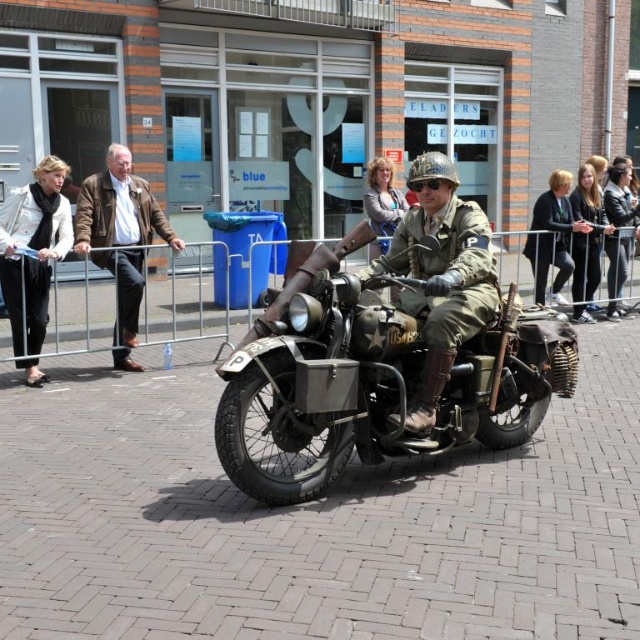
You are a photographer at the event and want to capture both the camouflage fabric jacket at center and the white leather jacket at left in a single shot. Which jacket should you focus on first to ensure both are in frame?

The camouflage fabric jacket at center is positioned under the white leather jacket at left, so focusing on the white leather jacket at left first will ensure both are in frame as the camouflage jacket is below it.

You are a photographer positioned at the center of the image. You want to capture a photo of the matte olive green motorcycle at center. Where should you point your camera to ensure the motorcycle is centered in your shot?

The matte olive green motorcycle at center is already positioned at the center of the image at coordinates point (376, 378), so pointing the camera towards the center will capture it perfectly.

Based on the photo, you are a photographer standing behind the metal barricade. You want to take a photo of both the camouflage fabric jacket at center and the white leather jacket at left. Which jacket should you focus on first to ensure both are in clear view?

You should focus on the camouflage fabric jacket at center first because it is closer to the viewer than the white leather jacket at left, ensuring both are in clear view by adjusting the focus from near to far.